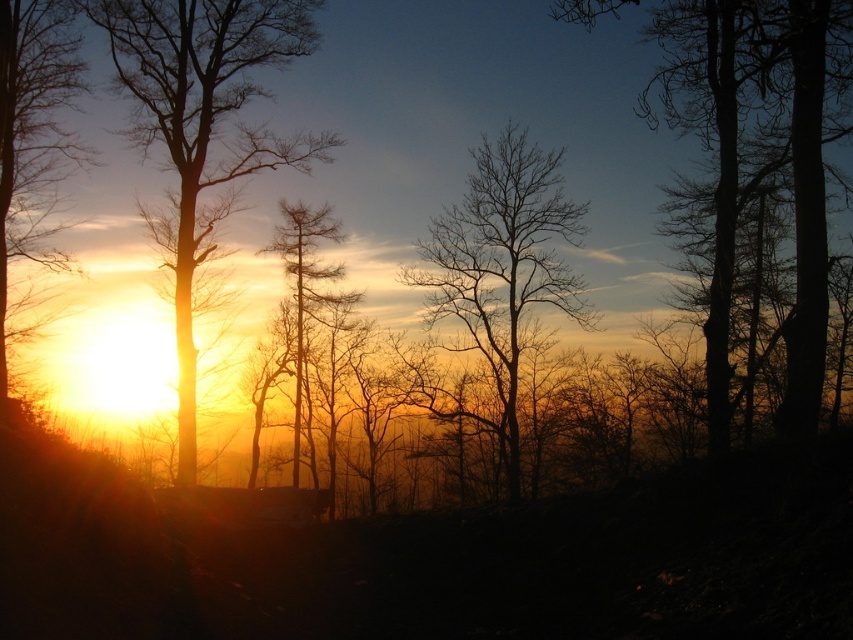
Based on the photo, you are an artist trying to sketch this sunset scene. You want to place the silhouette bark tree at right and the silvery textured pine tree at center correctly. Which tree should you draw first if you start from the left side of your paper?

You should draw the silvery textured pine tree at center first because the silhouette bark tree at right is positioned on the right side of it, meaning the silvery textured pine tree at center is closer to the left side.

You are standing in the forest and want to take a photo of the sunset with the bare branches at center in the foreground. If you are currently 50 feet away from the branches, should you move closer or farther away to ensure the branches are in the foreground of your photo?

The bare branches at center are currently 44.39 feet away from the camera. Since you are 50 feet away, you need to move closer to the branches to bring them into the foreground of your photo.